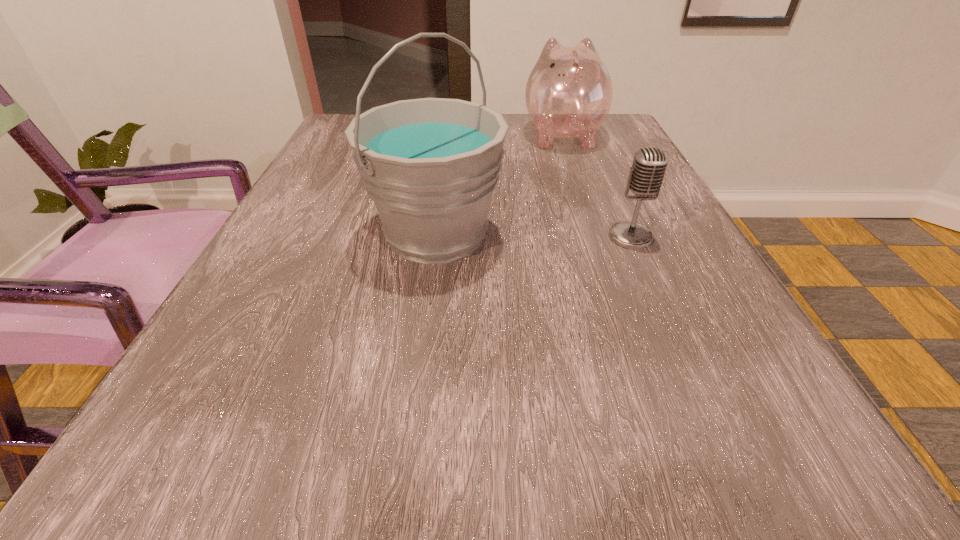
The width and height of the screenshot is (960, 540). What are the coordinates of `unoccupied position between the bucket and the farthest object` in the screenshot? It's located at (499, 184).

Identify the location of empty location between the farthest object and the bucket. (499, 184).

Where is `free spot between the second shortest object and the bucket`? free spot between the second shortest object and the bucket is located at coordinates (499, 184).

The width and height of the screenshot is (960, 540). I want to click on vacant space in between the leftmost object and the shortest object, so click(x=534, y=235).

You are a GUI agent. You are given a task and a screenshot of the screen. Output one action in this format:
    pyautogui.click(x=<x>, y=<y>)
    Task: Click on the free spot between the microphone and the farthest object
    The height and width of the screenshot is (540, 960).
    Given the screenshot: What is the action you would take?
    pyautogui.click(x=596, y=186)

You are a GUI agent. You are given a task and a screenshot of the screen. Output one action in this format:
    pyautogui.click(x=<x>, y=<y>)
    Task: Click on the vacant area that lies between the tallest object and the microphone
    The width and height of the screenshot is (960, 540).
    Given the screenshot: What is the action you would take?
    pyautogui.click(x=534, y=235)

You are a GUI agent. You are given a task and a screenshot of the screen. Output one action in this format:
    pyautogui.click(x=<x>, y=<y>)
    Task: Click on the blank region between the bucket and the farthest object
    The image size is (960, 540).
    Given the screenshot: What is the action you would take?
    pyautogui.click(x=499, y=184)

Locate which object ranks second in proximity to the microphone. Please provide its 2D coordinates. Your answer should be formatted as a tuple, i.e. [(x, y)], where the tuple contains the x and y coordinates of a point satisfying the conditions above.

[(569, 91)]

Find the location of a particular element. object that ranks as the second closest to the piggy bank is located at coordinates (646, 175).